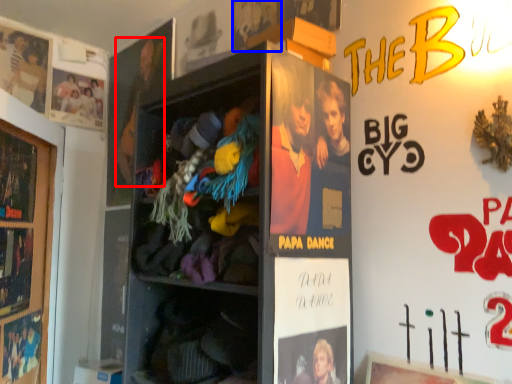
Question: Which point is further to the camera, person (highlighted by a red box) or movie poster (highlighted by a blue box)?

Choices:
 (A) person
 (B) movie poster

Answer: (A)